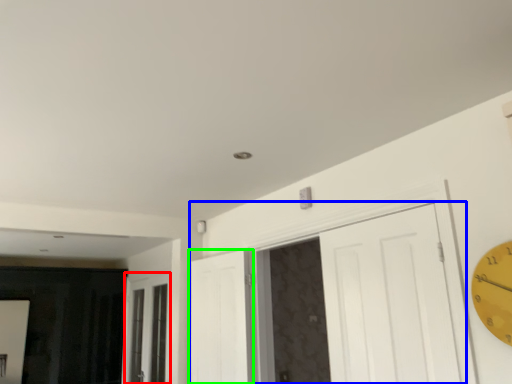
Question: Which object is positioned closest to window (highlighted by a red box)? Select from door (highlighted by a blue box) and door (highlighted by a green box).

Choices:
 (A) door
 (B) door

Answer: (B)